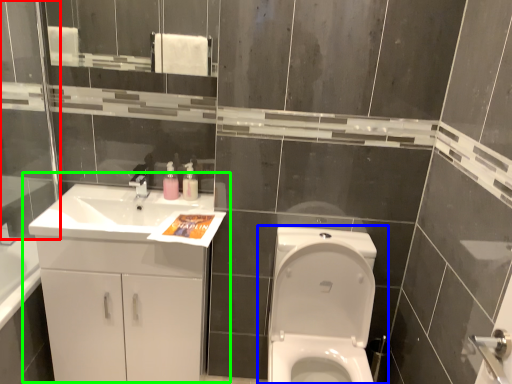
Question: Estimate the real-world distances between objects in this image. Which object is closer to glass door (highlighted by a red box), toilet (highlighted by a blue box) or bathroom cabinet (highlighted by a green box)?

Choices:
 (A) toilet
 (B) bathroom cabinet

Answer: (B)